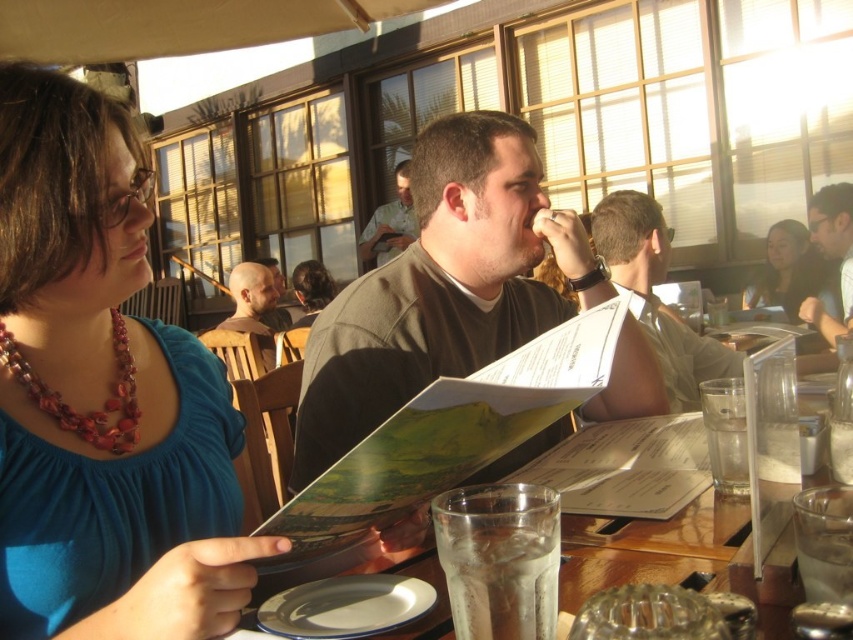
Question: Is matte brown shirt at center closer to camera compared to bald head at center?

Choices:
 (A) no
 (B) yes

Answer: (B)

Question: Estimate the real-world distances between objects in this image. Which object is closer to the matte black hair at upper right?

Choices:
 (A) clear glass at lower center
 (B) light brown shirt at center
 (C) white paper menu at center

Answer: (C)

Question: Does multicolored beaded necklace at left have a lesser width compared to matte black hair at upper right?

Choices:
 (A) yes
 (B) no

Answer: (A)

Question: Which point is farther to the camera?

Choices:
 (A) multicolored beaded necklace at left
 (B) dark brown hair at center
 (C) matte brown shirt at center
 (D) matte black hair at upper right

Answer: (B)

Question: Which of the following is the farthest from the observer?

Choices:
 (A) click(96, 419)
 (B) click(251, 321)
 (C) click(834, 216)
 (D) click(424, 336)

Answer: (B)

Question: Is clear glass at lower center closer to the viewer compared to light brown shirt at center?

Choices:
 (A) no
 (B) yes

Answer: (B)